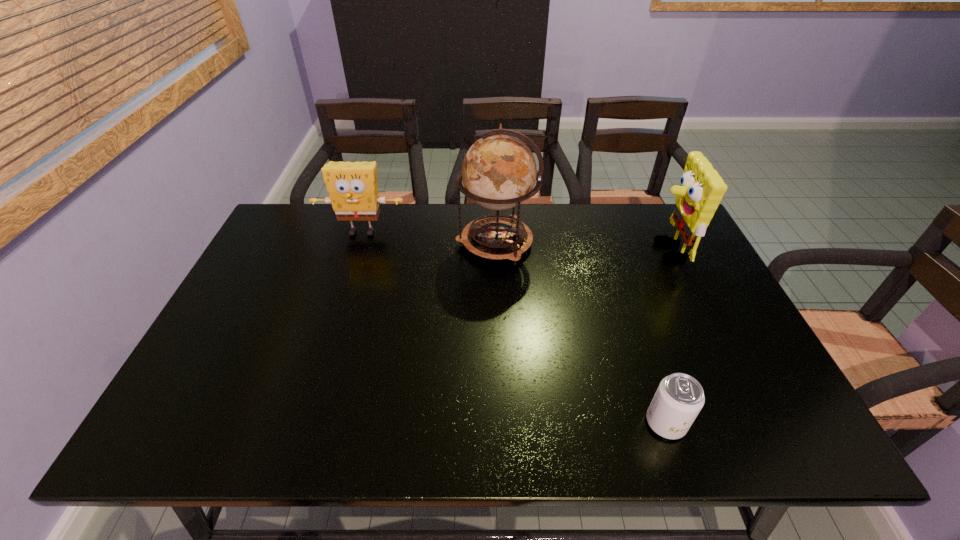
This screenshot has width=960, height=540. What are the coordinates of `globe` in the screenshot? It's located at (499, 171).

At what (x,y) coordinates should I click in order to perform the action: click on the tallest object. Please return your answer as a coordinate pair (x, y). This screenshot has width=960, height=540. Looking at the image, I should click on (499, 171).

Locate an element on the screen. This screenshot has width=960, height=540. the second tallest object is located at coordinates (701, 189).

Where is `the taller sponge`? This screenshot has height=540, width=960. the taller sponge is located at coordinates (701, 189).

Where is `the shorter sponge`? Image resolution: width=960 pixels, height=540 pixels. the shorter sponge is located at coordinates (352, 186).

What are the coordinates of `the leftmost object` in the screenshot? It's located at (352, 186).

Where is `soda can`? The width and height of the screenshot is (960, 540). soda can is located at coordinates (679, 398).

The height and width of the screenshot is (540, 960). Identify the location of the third object from left to right. point(679,398).

Where is `vacant area situated 0.130m at the center of the tallest object`? This screenshot has width=960, height=540. vacant area situated 0.130m at the center of the tallest object is located at coordinates (414, 242).

Locate an element on the screen. The width and height of the screenshot is (960, 540). vacant region located at the center of the tallest object is located at coordinates (333, 242).